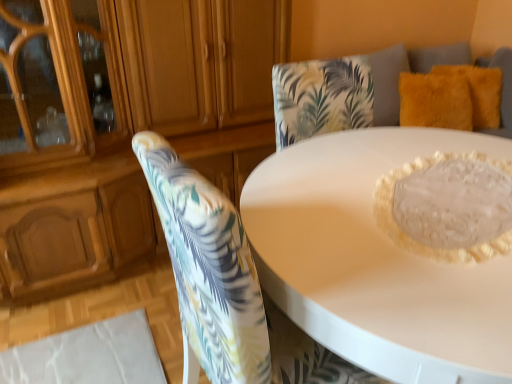
What do you see at coordinates (375, 261) in the screenshot? I see `white glossy table at center` at bounding box center [375, 261].

You are a GUI agent. You are given a task and a screenshot of the screen. Output one action in this format:
    pyautogui.click(x=<x>, y=<y>)
    Task: Click on the fuzzy yellow pillow at upper right, which is the second pillow from left to right
    
    Given the screenshot: What is the action you would take?
    pyautogui.click(x=479, y=92)

Measure the distance between fuzzy yellow pillow at upper right, the 2th pillow positioned from the right, and camera.

2.42 meters.

Where is `translucent glass cake at center`? This screenshot has width=512, height=384. translucent glass cake at center is located at coordinates (420, 243).

I want to click on white glossy table at center, so click(x=375, y=261).

Is translucent glass cake at center far from floral fabric chair at center?

No, there isn't a large distance between translucent glass cake at center and floral fabric chair at center.

What's the angular difference between translucent glass cake at center and floral fabric chair at center's facing directions?

The angle between the facing direction of translucent glass cake at center and the facing direction of floral fabric chair at center is 158 degrees.

Considering the relative sizes of translucent glass cake at center and floral fabric chair at center in the image provided, is translucent glass cake at center taller than floral fabric chair at center?

No, translucent glass cake at center is not taller than floral fabric chair at center.

Would you say floral fabric chair at center is outside white glossy table at center?

No, most part of floral fabric chair at center lies within white glossy table at center.

Which of these two, floral fabric chair at center or white glossy table at center, is thinner?

Thinner between the two is floral fabric chair at center.

Which of these two, floral fabric chair at center or white glossy table at center, is bigger?

white glossy table at center.

Is matte wood dresser at upper left taller or shorter than fuzzy yellow pillow at upper right, which is the second pillow from left to right?

matte wood dresser at upper left is taller than fuzzy yellow pillow at upper right, which is the second pillow from left to right.

From the picture: Is matte wood dresser at upper left oriented away from fuzzy yellow pillow at upper right, which is the second pillow from left to right?

matte wood dresser at upper left does not have its back to fuzzy yellow pillow at upper right, which is the second pillow from left to right.

From the image's perspective, is matte wood dresser at upper left above or below fuzzy yellow pillow at upper right, positioned as the first pillow in right-to-left order?

matte wood dresser at upper left is below fuzzy yellow pillow at upper right, positioned as the first pillow in right-to-left order.

How much distance is there between fuzzy yellow pillow at upper right, the 2th pillow positioned from the right, and floral fabric chair at center?

A distance of 1.91 meters exists between fuzzy yellow pillow at upper right, the 2th pillow positioned from the right, and floral fabric chair at center.

Is point (428, 75) positioned in front of point (191, 218)?

No.

From a real-world perspective, does fuzzy yellow pillow at upper right, the 2th pillow positioned from the right, sit lower than floral fabric chair at center?

No, from a real-world perspective, fuzzy yellow pillow at upper right, the 2th pillow positioned from the right, is not under floral fabric chair at center.

Considering the sizes of objects fuzzy yellow pillow at upper right, the 2th pillow positioned from the right, and floral fabric chair at center in the image provided, who is smaller, fuzzy yellow pillow at upper right, the 2th pillow positioned from the right, or floral fabric chair at center?

Smaller between the two is fuzzy yellow pillow at upper right, the 2th pillow positioned from the right.

In the scene shown: Measure the distance from floral fabric chair at center to matte wood dresser at upper left.

3.56 feet.

Which is more to the left, floral fabric chair at center or matte wood dresser at upper left?

From the viewer's perspective, matte wood dresser at upper left appears more on the left side.

Is floral fabric chair at center behind matte wood dresser at upper left?

No, the depth of floral fabric chair at center is less than that of matte wood dresser at upper left.

From a real-world perspective, is floral fabric chair at center beneath matte wood dresser at upper left?

Correct, in the physical world, floral fabric chair at center is lower than matte wood dresser at upper left.

Considering the sizes of white glossy table at center and matte wood dresser at upper left in the image, is white glossy table at center wider or thinner than matte wood dresser at upper left?

Considering their sizes, white glossy table at center looks broader than matte wood dresser at upper left.

The height and width of the screenshot is (384, 512). What are the coordinates of `table that appears below the matte wood dresser at upper left (from the image's perspective)` in the screenshot? It's located at (375, 261).

Between white glossy table at center and matte wood dresser at upper left, which one is positioned behind?

matte wood dresser at upper left is more distant.

Which is more to the left, white glossy table at center or matte wood dresser at upper left?

matte wood dresser at upper left.

Are fuzzy yellow pillow at upper right, which is the 1th pillow from left to right, and white glossy table at center far apart?

Yes, fuzzy yellow pillow at upper right, which is the 1th pillow from left to right, is far from white glossy table at center.

Is white glossy table at center inside fuzzy yellow pillow at upper right, which is the 1th pillow from left to right?

Definitely not — white glossy table at center is not inside fuzzy yellow pillow at upper right, which is the 1th pillow from left to right.

Is fuzzy yellow pillow at upper right, which is the 1th pillow from left to right, taller or shorter than white glossy table at center?

Clearly, fuzzy yellow pillow at upper right, which is the 1th pillow from left to right, is shorter compared to white glossy table at center.

This screenshot has height=384, width=512. In order to click on chair that is under the translucent glass cake at center (from a real-world perspective) in this screenshot , I will do `click(227, 286)`.

This screenshot has height=384, width=512. What are the coordinates of `table that appears in front of the floral fabric chair at center` in the screenshot? It's located at (375, 261).

Which object lies nearer to the anchor point white glossy table at center, fuzzy yellow pillow at upper right, positioned as the first pillow in right-to-left order, or fuzzy yellow pillow at upper right, the 2th pillow positioned from the right?

fuzzy yellow pillow at upper right, the 2th pillow positioned from the right, is closer to white glossy table at center.

From the image, which object appears to be nearer to matte wood dresser at upper left, floral fabric chair at center or fuzzy yellow pillow at upper right, the 2th pillow positioned from the right?

floral fabric chair at center lies closer to matte wood dresser at upper left than the other object.

From the image, which object appears to be nearer to fuzzy yellow pillow at upper right, which is the 1th pillow from left to right, translucent glass cake at center or floral fabric chair at center?

translucent glass cake at center is closer to fuzzy yellow pillow at upper right, which is the 1th pillow from left to right.

Estimate the real-world distances between objects in this image. Which object is further from translucent glass cake at center, floral fabric chair at center or fuzzy yellow pillow at upper right, the 2th pillow positioned from the right?

fuzzy yellow pillow at upper right, the 2th pillow positioned from the right, is further to translucent glass cake at center.

When comparing their distances from floral fabric chair at center, does translucent glass cake at center or white glossy table at center seem further?

translucent glass cake at center is further to floral fabric chair at center.

Based on their spatial positions, is matte wood dresser at upper left or translucent glass cake at center closer to fuzzy yellow pillow at upper right, the 2th pillow positioned from the right?

Based on the image, translucent glass cake at center appears to be nearer to fuzzy yellow pillow at upper right, the 2th pillow positioned from the right.

In the scene shown: Estimate the real-world distances between objects in this image. Which object is closer to matte wood dresser at upper left, translucent glass cake at center or fuzzy yellow pillow at upper right, the 2th pillow positioned from the right?

Based on the image, translucent glass cake at center appears to be nearer to matte wood dresser at upper left.

Looking at this image, considering their positions, is fuzzy yellow pillow at upper right, the 2th pillow positioned from the right, positioned closer to matte wood dresser at upper left than translucent glass cake at center?

translucent glass cake at center lies closer to matte wood dresser at upper left than the other object.

In order to click on food between white glossy table at center and fuzzy yellow pillow at upper right, which is the 1th pillow from left to right, from front to back in this screenshot , I will do 420,243.

Where is `food between floral fabric chair at center and fuzzy yellow pillow at upper right, which is the 1th pillow from left to right, in the front-back direction`? This screenshot has width=512, height=384. food between floral fabric chair at center and fuzzy yellow pillow at upper right, which is the 1th pillow from left to right, in the front-back direction is located at coordinates (420, 243).

Where is `pillow between matte wood dresser at upper left and fuzzy yellow pillow at upper right, which is the second pillow from left to right, from left to right`? This screenshot has width=512, height=384. pillow between matte wood dresser at upper left and fuzzy yellow pillow at upper right, which is the second pillow from left to right, from left to right is located at coordinates (435, 101).

I want to click on chair located between matte wood dresser at upper left and translucent glass cake at center in the left-right direction, so click(x=227, y=286).